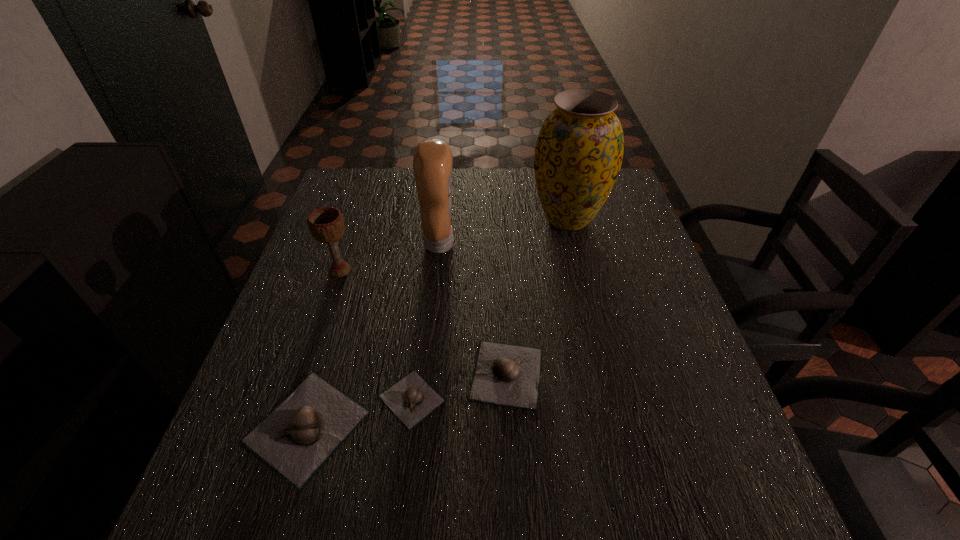
At what (x,y) coordinates should I click in order to perform the action: click on object located at the far right corner. Please return your answer as a coordinate pair (x, y). This screenshot has height=540, width=960. Looking at the image, I should click on (579, 151).

Where is `vacant space at the far edge`? The width and height of the screenshot is (960, 540). vacant space at the far edge is located at coordinates (536, 207).

This screenshot has width=960, height=540. In order to click on free space at the left edge in this screenshot , I will do [x=313, y=280].

Locate an element on the screen. vacant space at the right edge is located at coordinates (660, 276).

Find the location of `free region at the far left corner of the desktop`. free region at the far left corner of the desktop is located at coordinates (361, 173).

I want to click on free space between the leftmost garlic and the second tallest object, so click(373, 335).

The image size is (960, 540). Find the location of `vacant space that is in between the condiment and the chalice`. vacant space that is in between the condiment and the chalice is located at coordinates (390, 257).

Where is `free spot between the second shortest garlic and the shortest garlic`? free spot between the second shortest garlic and the shortest garlic is located at coordinates (459, 386).

Where is `vacant space that is in between the third tallest object and the fifth tallest object`? This screenshot has height=540, width=960. vacant space that is in between the third tallest object and the fifth tallest object is located at coordinates (423, 322).

I want to click on vacant area that lies between the fourth shortest object and the second tallest garlic, so click(423, 322).